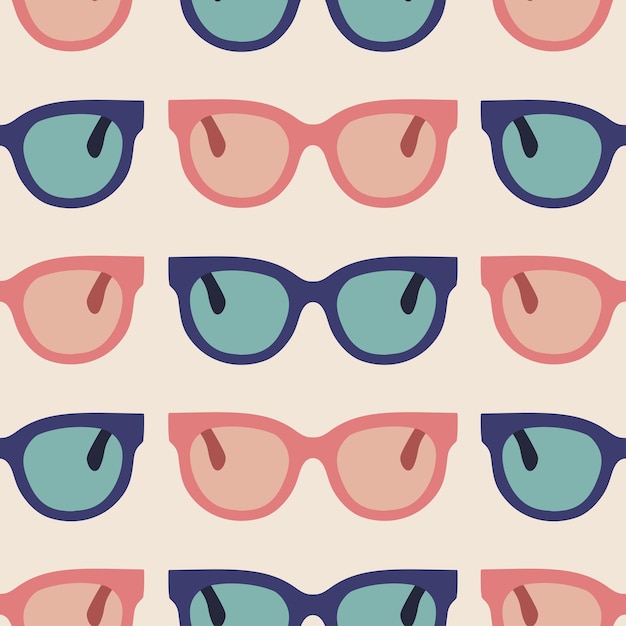
In order to click on bottom row of glasses in this screenshot , I will do `click(565, 593)`, `click(350, 606)`, `click(270, 606)`, `click(90, 596)`.